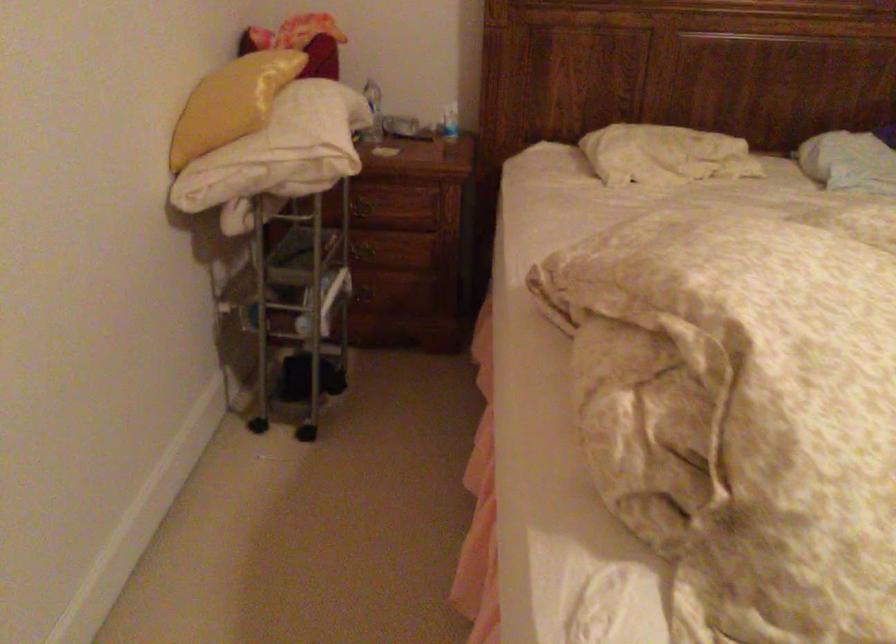
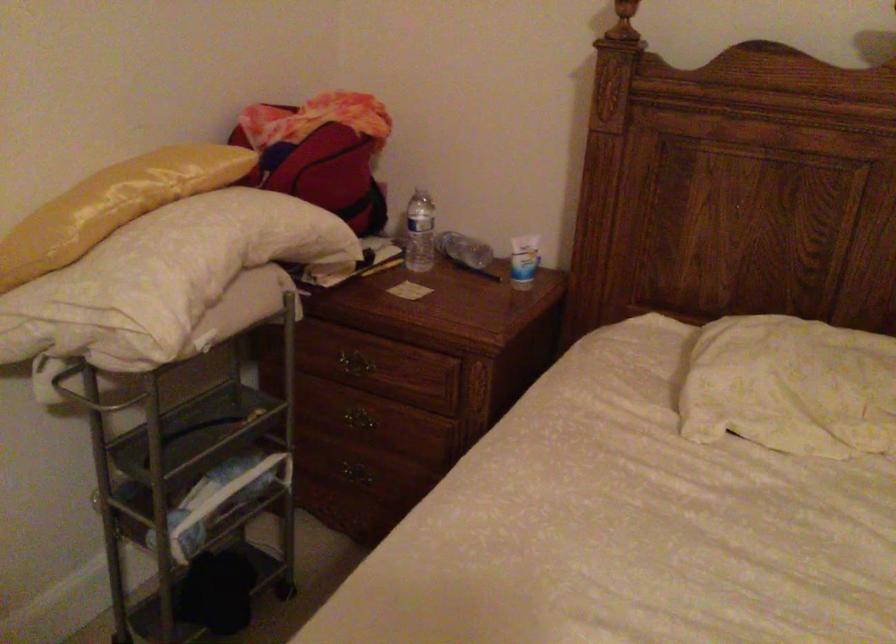
Where in the second image is the point corresponding to [333,129] from the first image?

(164, 278)